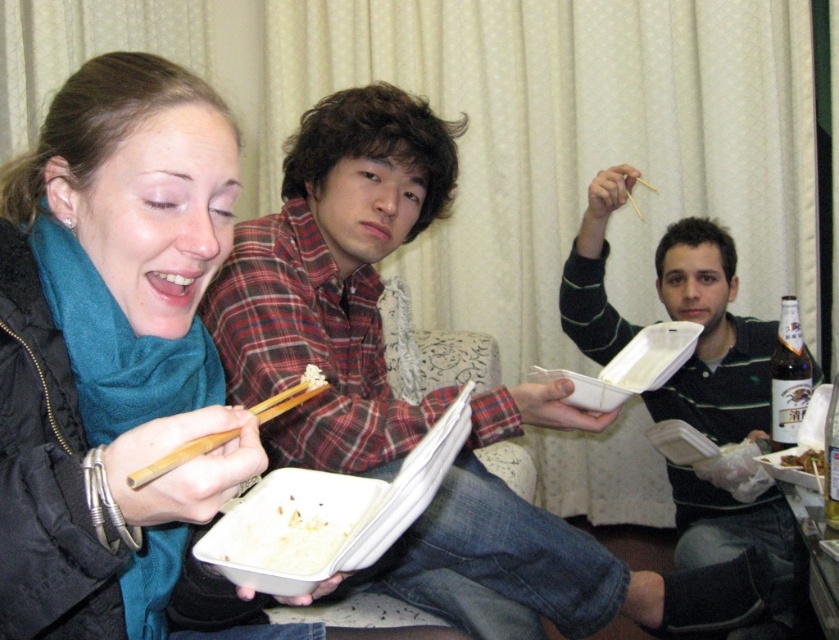
Can you confirm if matte black jacket at left is positioned to the right of wooden chopstick at upper right?

In fact, matte black jacket at left is to the left of wooden chopstick at upper right.

Can you confirm if matte black jacket at left is bigger than wooden chopstick at upper right?

Indeed, matte black jacket at left has a larger size compared to wooden chopstick at upper right.

Find the location of `matte black jacket at left`. matte black jacket at left is located at coordinates (121, 365).

Does plaid shirt at center appear on the left side of wooden chopsticks at left?

Incorrect, plaid shirt at center is not on the left side of wooden chopsticks at left.

Measure the distance between point (305,461) and camera.

Point (305,461) and camera are 4.25 feet apart from each other.

At what (x,y) coordinates should I click in order to perform the action: click on plaid shirt at center. Please return your answer as a coordinate pair (x, y). The width and height of the screenshot is (839, 640). Looking at the image, I should click on (334, 280).

Is point (311, 368) behind point (814, 476)?

No, (311, 368) is in front of (814, 476).

Does wooden chopsticks at left appear over white styrofoam container at center?

Indeed, wooden chopsticks at left is positioned over white styrofoam container at center.

You are a GUI agent. You are given a task and a screenshot of the screen. Output one action in this format:
    pyautogui.click(x=<x>, y=<y>)
    Task: Click on the wooden chopsticks at left
    This screenshot has height=640, width=839.
    Given the screenshot: What is the action you would take?
    pyautogui.click(x=180, y=458)